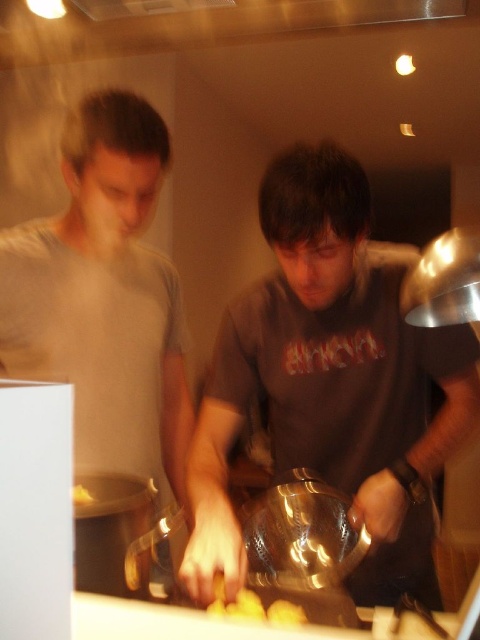
Can you confirm if matte gray shirt at center is smaller than metallic silver exhaust hood at upper right?

Actually, matte gray shirt at center might be larger than metallic silver exhaust hood at upper right.

Can you confirm if matte gray shirt at center is thinner than metallic silver exhaust hood at upper right?

No, matte gray shirt at center is not thinner than metallic silver exhaust hood at upper right.

Measure the distance between point (360, 364) and camera.

Point (360, 364) and camera are 3.56 feet apart from each other.

You are a GUI agent. You are given a task and a screenshot of the screen. Output one action in this format:
    pyautogui.click(x=<x>, y=<y>)
    Task: Click on the matte gray shirt at center
    This screenshot has width=480, height=640.
    Given the screenshot: What is the action you would take?
    pyautogui.click(x=332, y=381)

Who is shorter, matte gray shirt at left or yellow matte potato at center?

yellow matte potato at center

Between point (181, 404) and point (296, 620), which one is positioned in front?

Point (296, 620) is in front.

Does point (0, 260) come closer to viewer compared to point (292, 616)?

No.

The image size is (480, 640). What are the coordinates of `matte gray shirt at left` in the screenshot? It's located at (104, 296).

What do you see at coordinates (444, 282) in the screenshot? This screenshot has width=480, height=640. I see `metallic silver exhaust hood at upper right` at bounding box center [444, 282].

Measure the distance from metallic silver exhaust hood at upper right to yellow matte potato at center.

metallic silver exhaust hood at upper right is 18.40 inches away from yellow matte potato at center.

Between point (468, 257) and point (248, 609), which one is positioned in front?

Point (468, 257) is more forward.

At what (x,y) coordinates should I click in order to perform the action: click on metallic silver exhaust hood at upper right. Please return your answer as a coordinate pair (x, y). The width and height of the screenshot is (480, 640). Looking at the image, I should click on (444, 282).